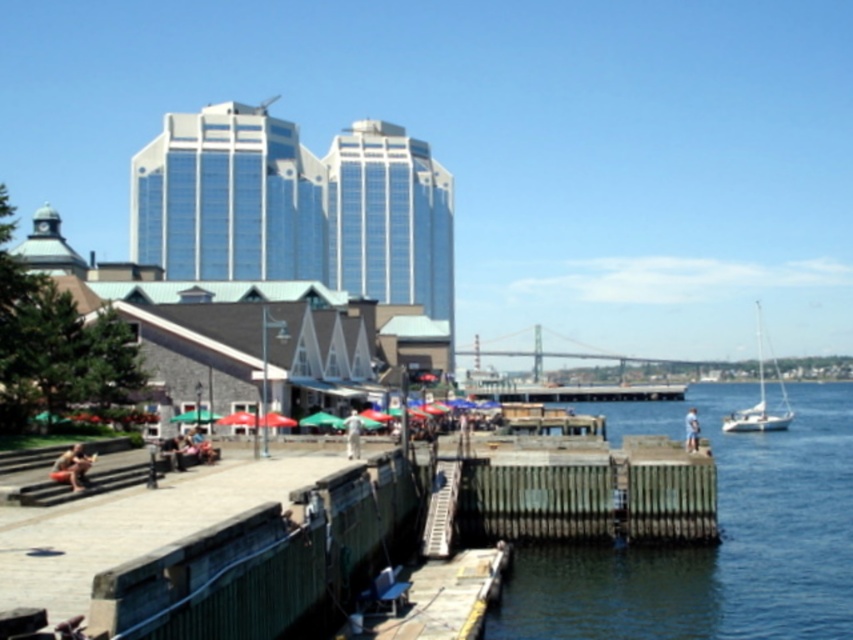
Question: Is clear water at dock right thinner than orange fabric person at lower left?

Choices:
 (A) no
 (B) yes

Answer: (A)

Question: Which object is positioned farthest from the white glossy sailboat at right?

Choices:
 (A) white fabric shirt at lower right
 (B) clear water at dock right
 (C) light brown wooden bench at center
 (D) orange fabric person at lower left

Answer: (D)

Question: Which object is farther from the camera taking this photo?

Choices:
 (A) white glossy sailboat at right
 (B) orange fabric person at lower left
 (C) clear water at dock right

Answer: (A)

Question: Is clear water at dock right wider than light brown wooden bench at center?

Choices:
 (A) yes
 (B) no

Answer: (A)

Question: Based on their relative distances, which object is farther from the clear water at dock right?

Choices:
 (A) white fabric shirt at lower right
 (B) light brown wooden bench at center
 (C) orange fabric person at lower left

Answer: (C)

Question: Can you confirm if orange fabric person at lower left is wider than light brown wooden bench at center?

Choices:
 (A) yes
 (B) no

Answer: (B)